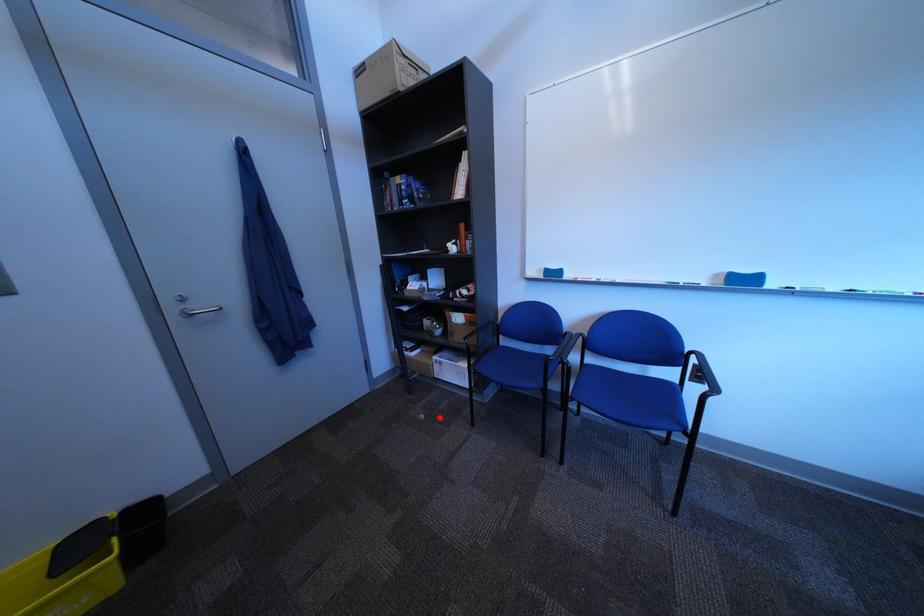
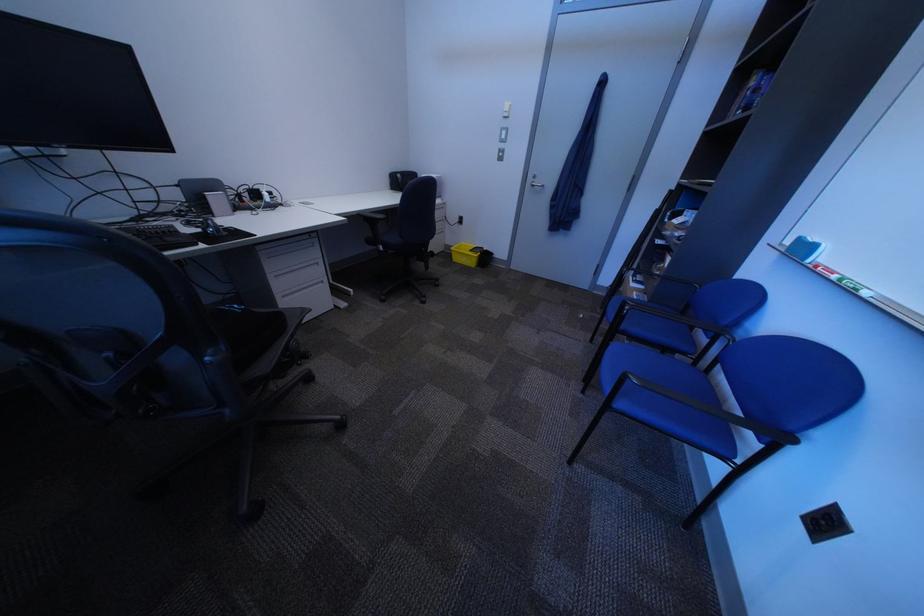
In the second image, find the point that corresponds to the highlighted location in the first image.

(599, 318)